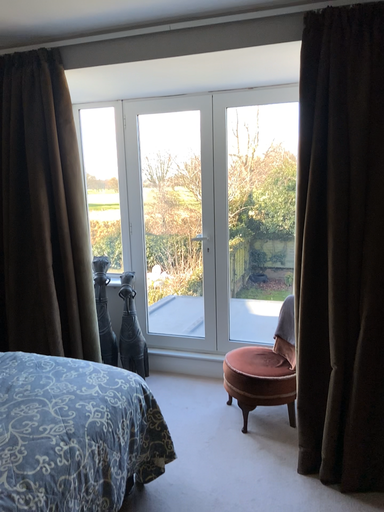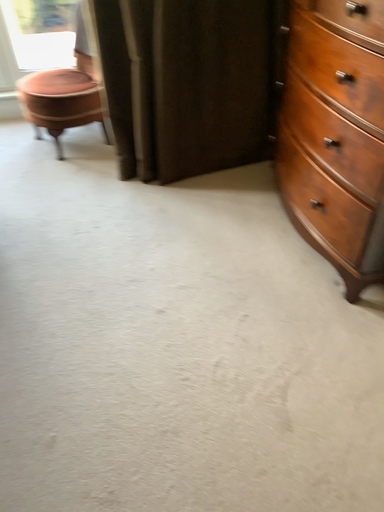
Question: Which way did the camera rotate in the video?

Choices:
 (A) rotated downward
 (B) rotated upward

Answer: (A)